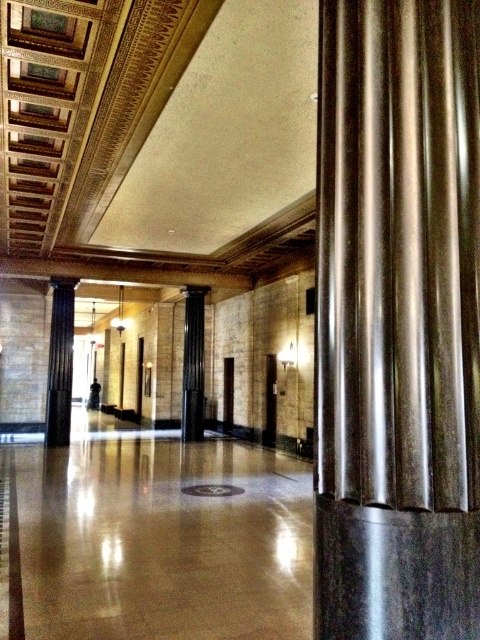
You are standing in the corridor of the grand building and notice two columns at the center. Which column is closer to you, the metallic polished column at center or the black polished column at center?

The metallic polished column at center is closer to you as it is positioned in front of the black polished column at center.

You are an architect designing a new building and want to ensure structural integrity. Given the image of the corridor with the metallic polished column at center and the black polished column at left, which column is positioned higher relative to the other?

The metallic polished column at center is positioned higher than the black polished column at left as it is described to be above it.